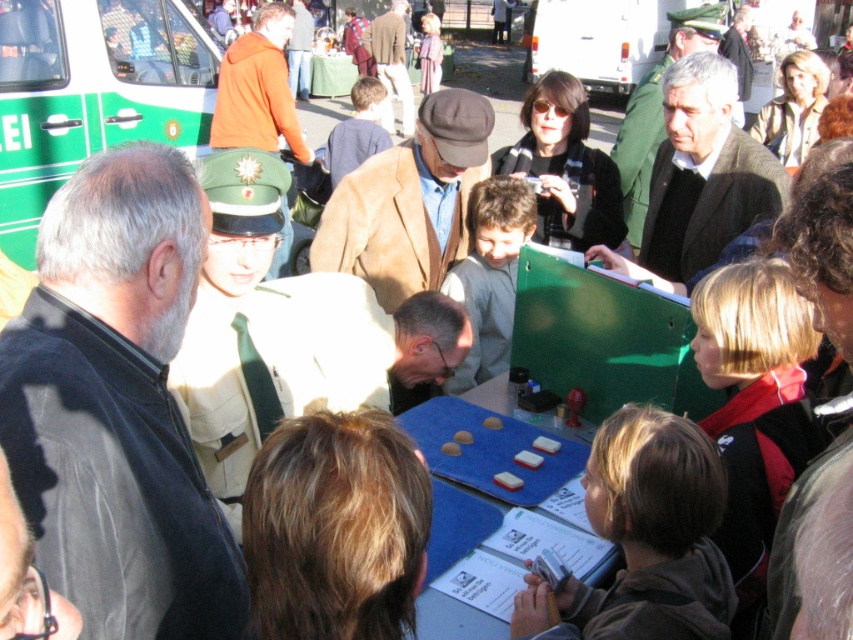
You are a photographer standing at the event. You want to take a photo of the green matte ambulance at left without any people blocking it. The crowd is currently 3 meters away from you. Is the ambulance far enough for you to capture it clearly without the crowd overlapping in the photo?

The green matte ambulance at left is 5.19 meters away from the camera. Since the crowd is only 3 meters away from you, the ambulance is farther than the crowd. Therefore, the crowd would appear in front of the ambulance in the photo, blocking it. To capture the ambulance without obstruction, you would need to move closer or ask the crowd to step aside.

You are an organizer at this event and need to determine which jacket is shorter between the matte brown jacket at center and the brown leather jacket at center. Which one should you choose?

The matte brown jacket at center is not as tall as the brown leather jacket at center, so you should choose the matte brown jacket at center as it is shorter.